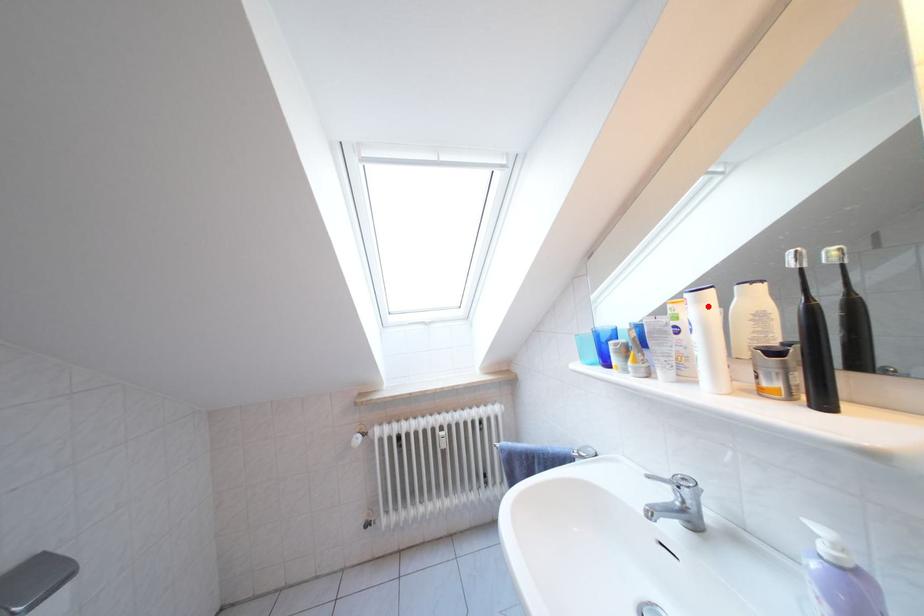
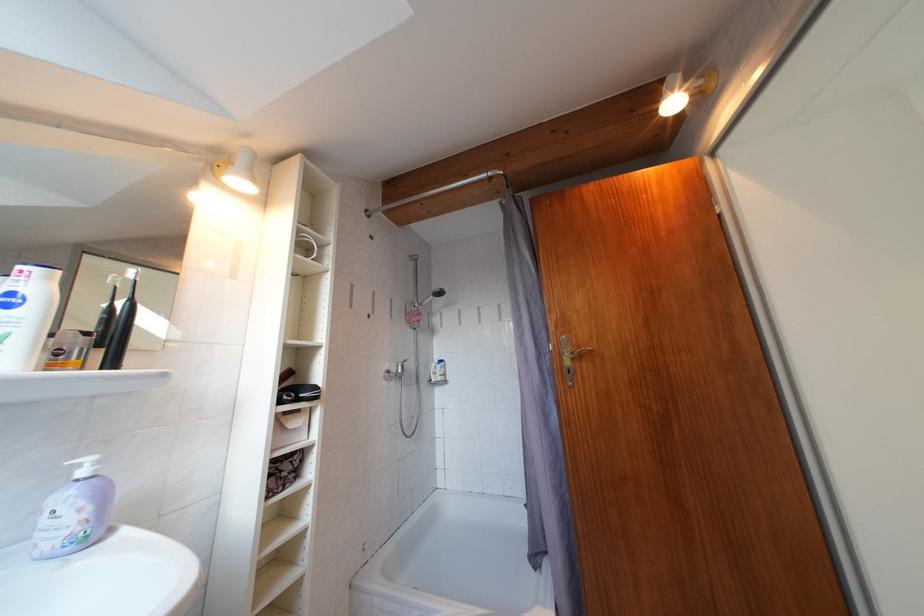
In the second image, find the point that corresponds to the highlighted location in the first image.

(56, 283)